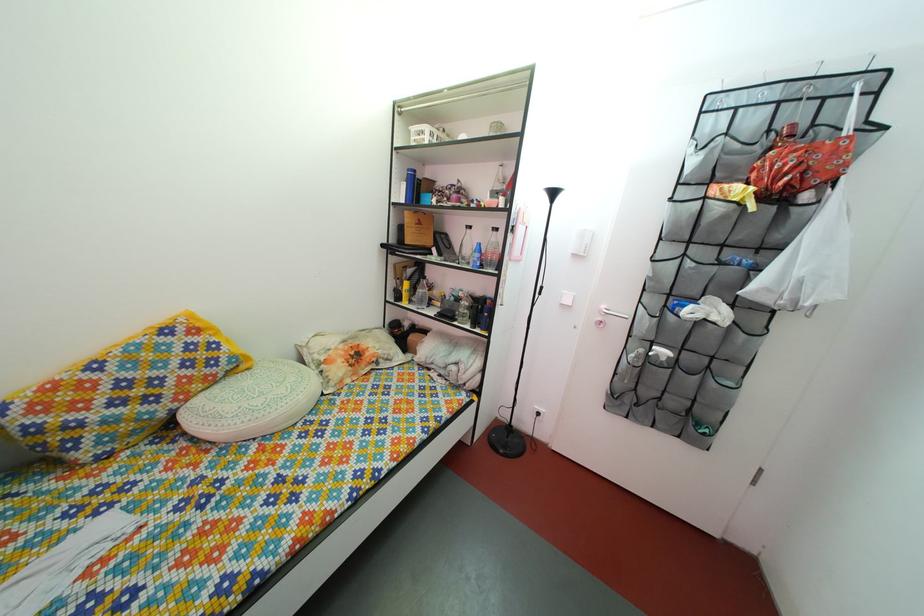
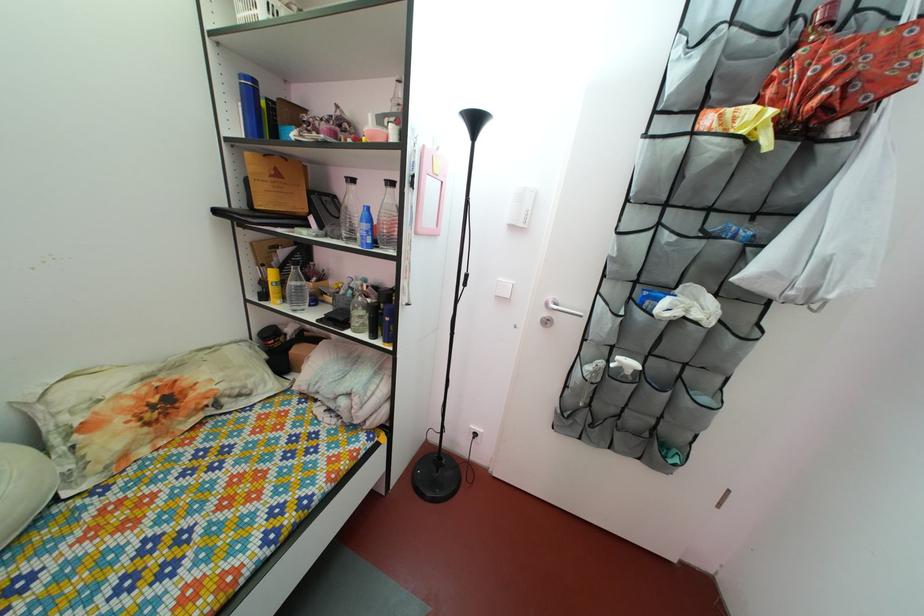
In the second image, find the point that corresponds to point 478,272 in the first image.

(363, 248)